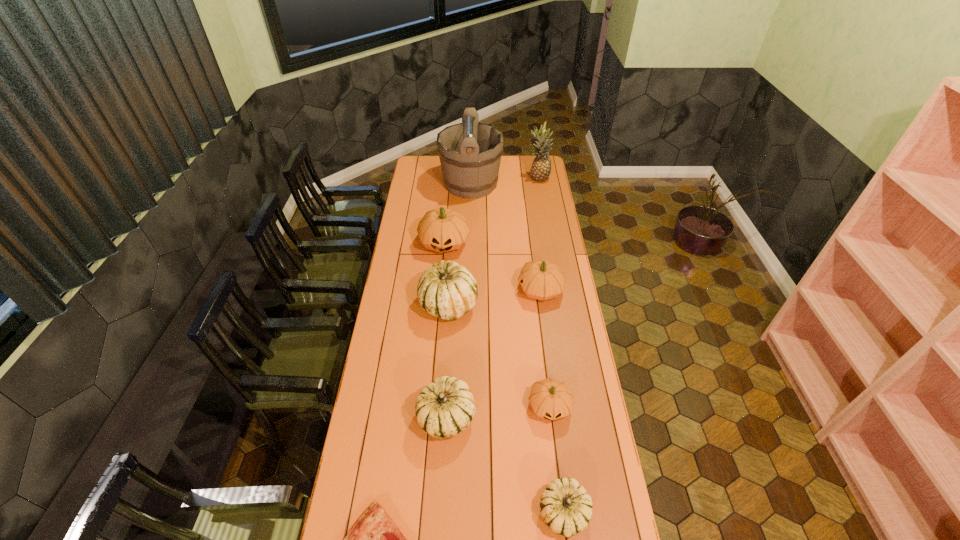
At what (x,y) coordinates should I click in order to perform the action: click on free location that satisfies the following two spatial constraints: 1. on the side of the biggest orange gourd with the carved face; 2. on the left side of the farthest white gourd. Please return your answer as a coordinate pair (x, y). This screenshot has height=540, width=960. Looking at the image, I should click on (439, 305).